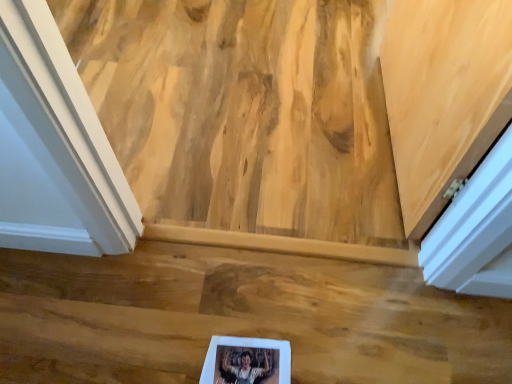
Identify the location of free space above white matte picture frame at lower center (from a real-world perspective). The image size is (512, 384). (243, 364).